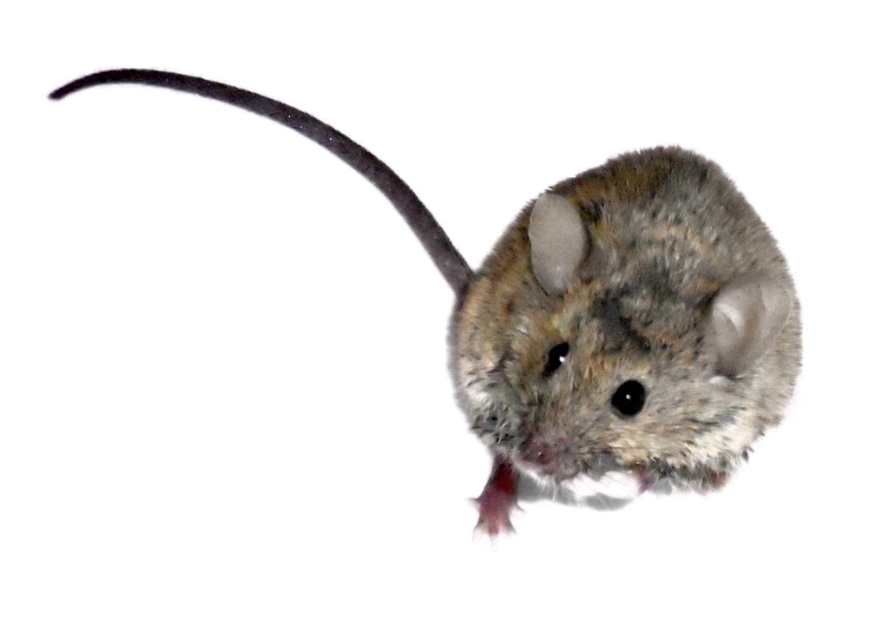
You are an animal caretaker observing a mouse in a cage. You notice the fuzzy gray mouse at center and the silvery metallic tail at upper left. Which object is bigger in size?

The fuzzy gray mouse at center is bigger in size compared to the silvery metallic tail at upper left.

You are observing a mouse in a white room and notice two points marked on its body. The points are labeled as point (774, 372) and point (250, 104). Which point is nearer to you?

Point (774, 372) is closer to the viewer than point (250, 104).